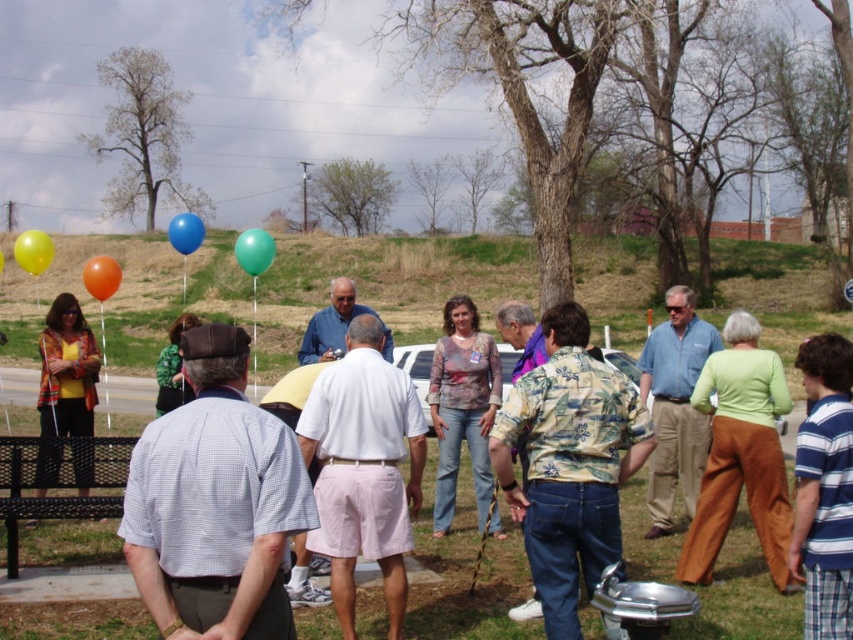
Can you confirm if printed cotton shirt at left is positioned below green rubber balloon at center?

Correct, printed cotton shirt at left is located below green rubber balloon at center.

Does point (65, 387) come behind point (242, 234)?

No, it is not.

Locate an element on the screen. The image size is (853, 640). printed cotton shirt at left is located at coordinates (67, 392).

Where is `printed cotton shirt at left`? The height and width of the screenshot is (640, 853). printed cotton shirt at left is located at coordinates (x=67, y=392).

Is matte yellow balloon at upper left shorter than blue rubber balloon at upper left?

Correct, matte yellow balloon at upper left is not as tall as blue rubber balloon at upper left.

Measure the distance from matte yellow balloon at upper left to blue rubber balloon at upper left.

matte yellow balloon at upper left is 3.65 meters away from blue rubber balloon at upper left.

Identify the location of matte yellow balloon at upper left. (33, 252).

Which is more to the left, green rubber balloon at center or yellow matte balloon at upper left?

yellow matte balloon at upper left

Is point (250, 273) more distant than point (3, 268)?

No, it is not.

At what (x,y) coordinates should I click in order to perform the action: click on green rubber balloon at center. Please return your answer as a coordinate pair (x, y). Looking at the image, I should click on (254, 250).